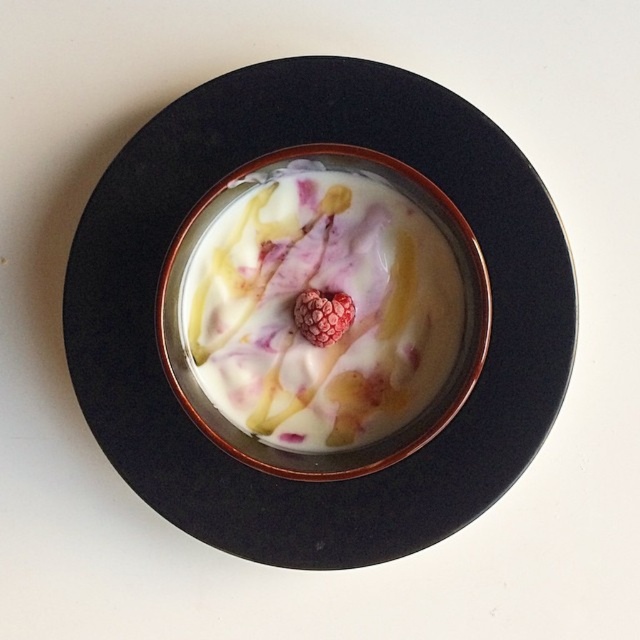
You are a food critic examining the dessert in the bowl. Which item, the white creamy yogurt at center or the raspberry at center, is positioned closer to your eyes?

The white creamy yogurt at center is closer to the viewer than the raspberry at center.

You are a photographer trying to capture a closeup of the black ceramic bowl at center. If your camera lens has a focal length of 50mm and you want to maintain a sharp focus, what is the minimum distance you should position the camera from the bowl?

The minimum distance should be at least 20.78 inches, as the black ceramic bowl at center is positioned exactly 20.78 inches away from the camera.